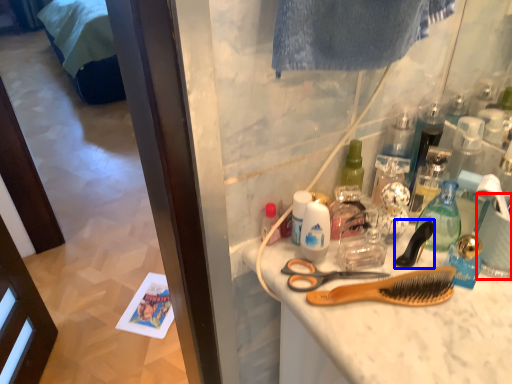
Question: Among these objects, which one is farthest to the camera, coffee cup (highlighted by a red box) or brush (highlighted by a blue box)?

Choices:
 (A) coffee cup
 (B) brush

Answer: (B)